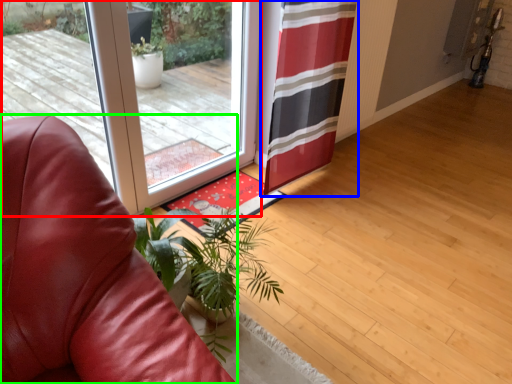
Question: Based on their relative distances, which object is nearer to door (highlighted by a red box)? Choose from curtain (highlighted by a blue box) and chair (highlighted by a green box).

Choices:
 (A) curtain
 (B) chair

Answer: (A)